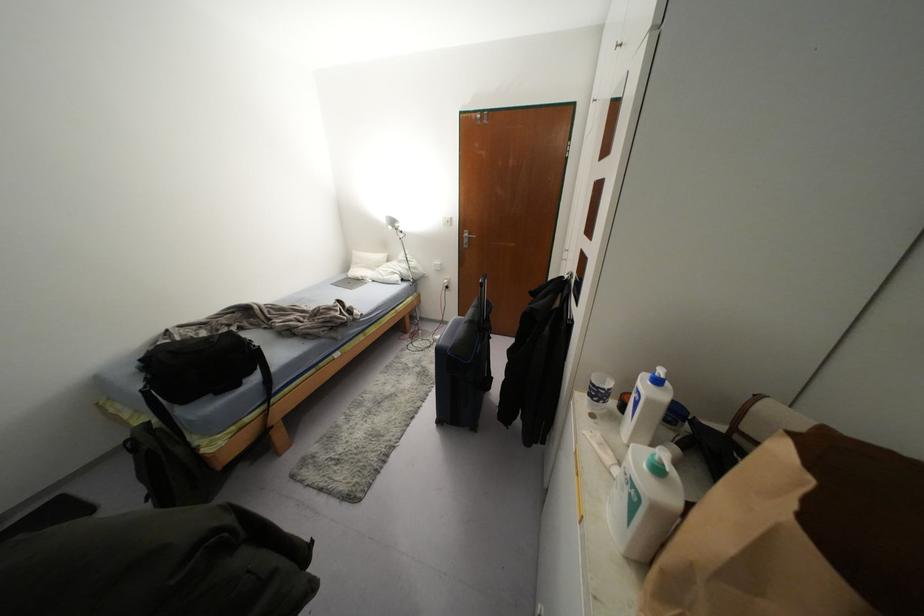
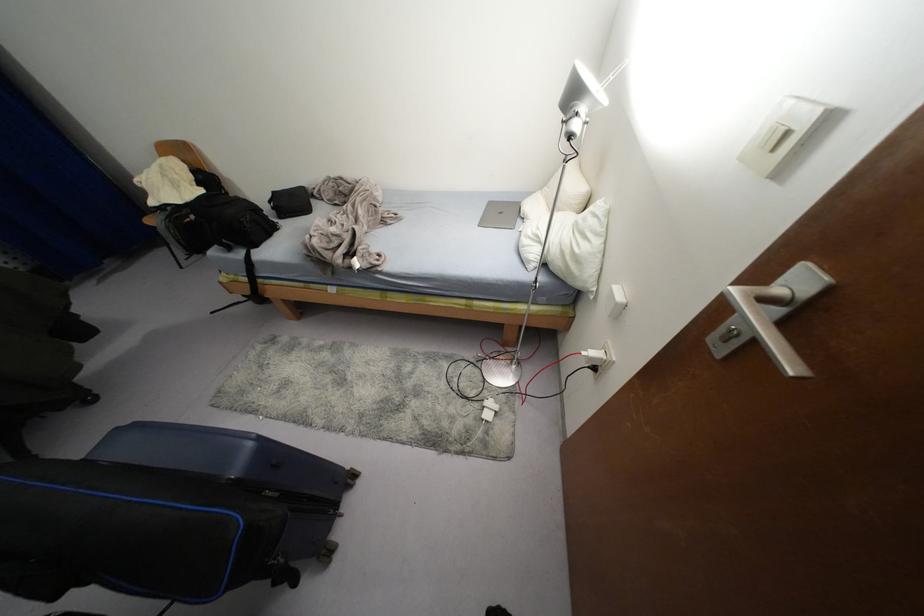
Find the pixel in the second image that matches point (444, 281) in the first image.

(592, 353)